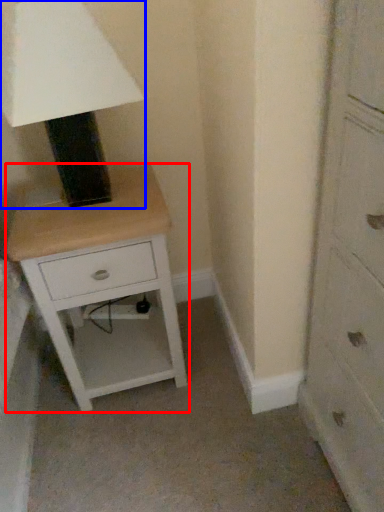
Question: Which object is further to the camera taking this photo, nightstand (highlighted by a red box) or table lamp (highlighted by a blue box)?

Choices:
 (A) nightstand
 (B) table lamp

Answer: (A)